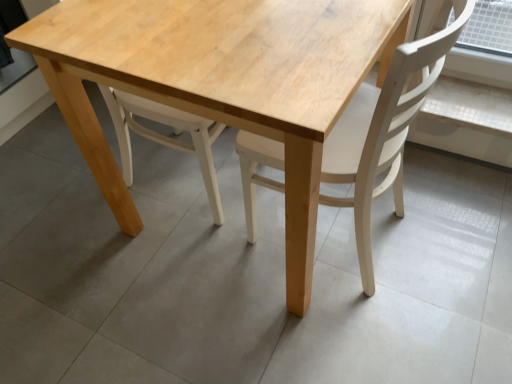
Question: Does natural wood table at center lie in front of light wood chair at center?

Choices:
 (A) yes
 (B) no

Answer: (B)

Question: Can you confirm if natural wood table at center is thinner than light wood chair at center?

Choices:
 (A) yes
 (B) no

Answer: (B)

Question: Can you confirm if natural wood table at center is smaller than light wood chair at center?

Choices:
 (A) no
 (B) yes

Answer: (A)

Question: From a real-world perspective, is natural wood table at center located beneath light wood chair at center?

Choices:
 (A) no
 (B) yes

Answer: (B)

Question: Is natural wood table at center wider than light wood chair at center?

Choices:
 (A) no
 (B) yes

Answer: (B)

Question: Can you confirm if natural wood table at center is bigger than light wood chair at center?

Choices:
 (A) no
 (B) yes

Answer: (B)

Question: Is light wood chair at center aimed at natural wood table at center?

Choices:
 (A) yes
 (B) no

Answer: (A)

Question: Does light wood chair at center have a smaller size compared to natural wood table at center?

Choices:
 (A) yes
 (B) no

Answer: (A)

Question: Is light wood chair at center facing away from natural wood table at center?

Choices:
 (A) yes
 (B) no

Answer: (A)

Question: Is light wood chair at center touching natural wood table at center?

Choices:
 (A) no
 (B) yes

Answer: (A)

Question: From the image's perspective, is light wood chair at center under natural wood table at center?

Choices:
 (A) no
 (B) yes

Answer: (B)

Question: Can you confirm if light wood chair at center is thinner than natural wood table at center?

Choices:
 (A) yes
 (B) no

Answer: (A)

Question: From their relative heights in the image, would you say light wood chair at center is taller or shorter than natural wood table at center?

Choices:
 (A) short
 (B) tall

Answer: (B)